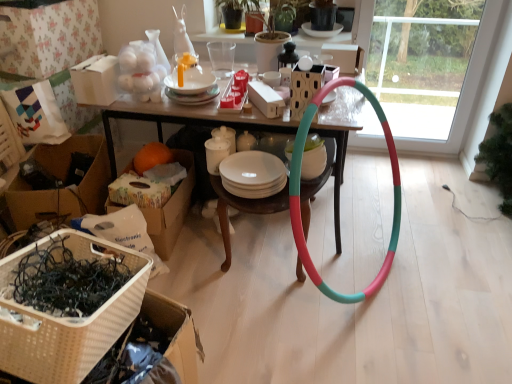
What do you see at coordinates (49, 37) in the screenshot?
I see `white paper bag at upper left, the 2th box when ordered from front to back` at bounding box center [49, 37].

The image size is (512, 384). What do you see at coordinates (62, 180) in the screenshot?
I see `cardboard at left, which is the 1th cardboard box in left-to-right order` at bounding box center [62, 180].

Image resolution: width=512 pixels, height=384 pixels. What do you see at coordinates (151, 157) in the screenshot?
I see `orange fuzzy at lower left` at bounding box center [151, 157].

Where is `orange fuzzy at lower left`? This screenshot has width=512, height=384. orange fuzzy at lower left is located at coordinates (151, 157).

In order to face white woven basket at lower left, should I rotate leftwards or rightwards?

To face it directly, rotate left by 23.493 degrees.

Where is `green matte plant at upper center`? The image size is (512, 384). green matte plant at upper center is located at coordinates (236, 11).

Which object is closer to the camera taking this photo, white paper bag at upper left, the 2th box when ordered from front to back, or orange fuzzy at lower left?

Positioned in front is white paper bag at upper left, the 2th box when ordered from front to back.

Based on the photo, from a real-world perspective, which object stands above the other?

Result: In real-world perspective, white paper bag at upper left, which appears as the second box when viewed from the back, is above.

Considering the sizes of objects white paper bag at upper left, the 2th box when ordered from front to back, and orange fuzzy at lower left in the image provided, who is shorter, white paper bag at upper left, the 2th box when ordered from front to back, or orange fuzzy at lower left?

orange fuzzy at lower left.

Where is `orange that appears below the white paper bag at upper left, the 1th box positioned from the left (from a real-world perspective)`? The height and width of the screenshot is (384, 512). orange that appears below the white paper bag at upper left, the 1th box positioned from the left (from a real-world perspective) is located at coordinates (151, 157).

Considering their positions, is matte white rectangular box at center, which appears as the 2th box when viewed from the left, located in front of or behind cardboard at left, marked as the third cardboard box in a right-to-left arrangement?

matte white rectangular box at center, which appears as the 2th box when viewed from the left, is positioned closer to the viewer than cardboard at left, marked as the third cardboard box in a right-to-left arrangement.

Consider the image. Which is closer to the camera, (x=273, y=110) or (x=37, y=203)?

Point (x=273, y=110) is closer to the camera than point (x=37, y=203).

Which object is thinner, matte white rectangular box at center, arranged as the 2th box when viewed from the right, or cardboard at left, marked as the third cardboard box in a right-to-left arrangement?

matte white rectangular box at center, arranged as the 2th box when viewed from the right, is thinner.

From the image's perspective, is matte white rectangular box at center, the third box in the top-to-bottom sequence, positioned above or below cardboard at left, marked as the third cardboard box in a right-to-left arrangement?

Based on their image positions, matte white rectangular box at center, the third box in the top-to-bottom sequence, is located above cardboard at left, marked as the third cardboard box in a right-to-left arrangement.

How many degrees apart are the facing directions of white cardboard box at upper left, which is the second cardboard box in right-to-left order, and orange fuzzy at lower left?

white cardboard box at upper left, which is the second cardboard box in right-to-left order, and orange fuzzy at lower left are facing 9.62 degrees away from each other.

Considering the positions of point (109, 86) and point (163, 159), is point (109, 86) closer or farther from the camera than point (163, 159)?

Point (109, 86) appears to be closer to the viewer than point (163, 159).

In the image, is white cardboard box at upper left, which is the second cardboard box in right-to-left order, positioned in front of or behind orange fuzzy at lower left?

Clearly, white cardboard box at upper left, which is the second cardboard box in right-to-left order, is in front of orange fuzzy at lower left.

Is white cardboard box at upper left, which is the second cardboard box in right-to-left order, facing away from orange fuzzy at lower left?

No, white cardboard box at upper left, which is the second cardboard box in right-to-left order,'s orientation is not away from orange fuzzy at lower left.

How different are the orientations of white paper bag at upper left, arranged as the third box when ordered from the bottom, and cardboard at left, marked as the third cardboard box in a right-to-left arrangement, in degrees?

The facing directions of white paper bag at upper left, arranged as the third box when ordered from the bottom, and cardboard at left, marked as the third cardboard box in a right-to-left arrangement, are 22.8 degrees apart.

Is white paper bag at upper left, which is the 3th box from right to left, facing towards cardboard at left, which is the 1th cardboard box in left-to-right order?

No, white paper bag at upper left, which is the 3th box from right to left, is not facing towards cardboard at left, which is the 1th cardboard box in left-to-right order.

Does point (32, 67) appear closer or farther from the camera than point (47, 162)?

Point (32, 67).

This screenshot has width=512, height=384. There is a cardboard at left, which is the 1th cardboard box in left-to-right order. Find the location of `the 3rd box above it (from a real-world perspective)`. the 3rd box above it (from a real-world perspective) is located at coordinates (49, 37).

Considering the sizes of objects wooden table at center and white woven basket at lower left in the image provided, who is shorter, wooden table at center or white woven basket at lower left?

Standing shorter between the two is white woven basket at lower left.

From a real-world perspective, between wooden table at center and white woven basket at lower left, who is vertically higher?

In real-world perspective, white woven basket at lower left is above.

Is wooden table at center positioned behind white woven basket at lower left?

That is True.

Which of these two, orange fuzzy at lower left or transparent glass door at center, is wider?

orange fuzzy at lower left.

Is orange fuzzy at lower left far from transparent glass door at center?

Absolutely, orange fuzzy at lower left is distant from transparent glass door at center.

Is orange fuzzy at lower left completely or partially outside of transparent glass door at center?

Yes.

Is orange fuzzy at lower left bigger or smaller than transparent glass door at center?

Clearly, orange fuzzy at lower left is smaller in size than transparent glass door at center.

Looking at their sizes, would you say orange fuzzy at lower left is wider or thinner than green matte plant at upper center?

Clearly, orange fuzzy at lower left has more width compared to green matte plant at upper center.

From the image's perspective, is orange fuzzy at lower left located above or below green matte plant at upper center?

Based on their image positions, orange fuzzy at lower left is located beneath green matte plant at upper center.

Identify the location of orange on the left side of green matte plant at upper center. The image size is (512, 384). (151, 157).

The height and width of the screenshot is (384, 512). There is a orange fuzzy at lower left. Find the location of `the 3rd box above it (from a real-world perspective)`. the 3rd box above it (from a real-world perspective) is located at coordinates (49, 37).

Where is `the 2nd cardboard box behind the matte white rectangular box at center, which appears as the 2th box when viewed from the left`? The width and height of the screenshot is (512, 384). the 2nd cardboard box behind the matte white rectangular box at center, which appears as the 2th box when viewed from the left is located at coordinates click(x=62, y=180).

Looking at the image, which one is located further to green matte plant at upper center, cardboard at left, marked as the third cardboard box in a right-to-left arrangement, or wooden table at center?

cardboard at left, marked as the third cardboard box in a right-to-left arrangement, lies further to green matte plant at upper center than the other object.

Which object lies further to the anchor point white woven basket at lower left, matte white rectangular box at center, arranged as the third box when viewed from the back, or orange fuzzy at lower left?

The object further to white woven basket at lower left is orange fuzzy at lower left.

Based on their spatial positions, is matte white cardboard box at upper center, which is counted as the second box, starting from the bottom, or white woven basket at lower left further from cardboard at left, which is the 1th cardboard box in left-to-right order?

matte white cardboard box at upper center, which is counted as the second box, starting from the bottom, is positioned further to the anchor cardboard at left, which is the 1th cardboard box in left-to-right order.

When comparing their distances from wooden table at center, does orange fuzzy at lower left or cardboard box at lower left, arranged as the first cardboard box when viewed from the right, seem closer?

Based on the image, orange fuzzy at lower left appears to be nearer to wooden table at center.

When comparing their distances from orange fuzzy at lower left, does white woven basket at lower left or cardboard at left, which is the 1th cardboard box in left-to-right order, seem closer?

Among the two, cardboard at left, which is the 1th cardboard box in left-to-right order, is located nearer to orange fuzzy at lower left.

From the image, which object appears to be nearer to orange fuzzy at lower left, white woven basket at lower left or matte white rectangular box at center, the third box in the top-to-bottom sequence?

matte white rectangular box at center, the third box in the top-to-bottom sequence, lies closer to orange fuzzy at lower left than the other object.

Consider the image. Estimate the real-world distances between objects in this image. Which object is closer to orange fuzzy at lower left, cardboard at left, marked as the third cardboard box in a right-to-left arrangement, or white cardboard box at upper left, which is the 2th cardboard box from left to right?

cardboard at left, marked as the third cardboard box in a right-to-left arrangement, is positioned closer to the anchor orange fuzzy at lower left.

Considering their positions, is matte white rectangular box at center, arranged as the 2th box when viewed from the right, positioned closer to green matte plant at upper center than white woven basket at lower left?

Among the two, matte white rectangular box at center, arranged as the 2th box when viewed from the right, is located nearer to green matte plant at upper center.

Find the location of `cardboard box located between orange fuzzy at lower left and wooden table at center in the left-right direction`. cardboard box located between orange fuzzy at lower left and wooden table at center in the left-right direction is located at coordinates (170, 209).

In order to click on houseplant between white cardboard box at upper left, which is the second cardboard box in right-to-left order, and matte white rectangular box at center, marked as the 1th box in a front-to-back arrangement, from left to right in this screenshot , I will do `click(236, 11)`.

Identify the location of cardboard box located between orange fuzzy at lower left and matte white cardboard box at upper center, the 2th box in the top-to-bottom sequence, in the left-right direction. The width and height of the screenshot is (512, 384). (170, 209).

The width and height of the screenshot is (512, 384). I want to click on orange between green matte plant at upper center and cardboard box at lower left, arranged as the first cardboard box when viewed from the right, in the up-down direction, so click(151, 157).